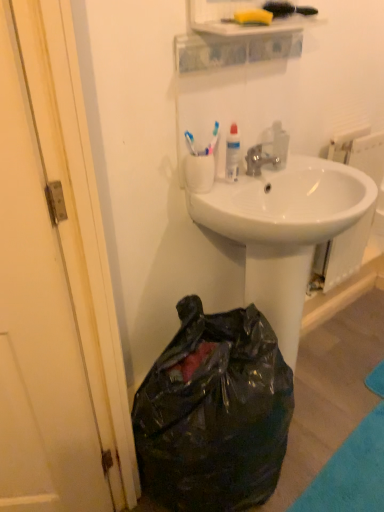
You are a GUI agent. You are given a task and a screenshot of the screen. Output one action in this format:
    pyautogui.click(x=<x>, y=<y>)
    Task: Click on the free location to the right of white plastic cup at upper center
    Image resolution: width=384 pixels, height=512 pixels.
    Given the screenshot: What is the action you would take?
    pyautogui.click(x=236, y=188)